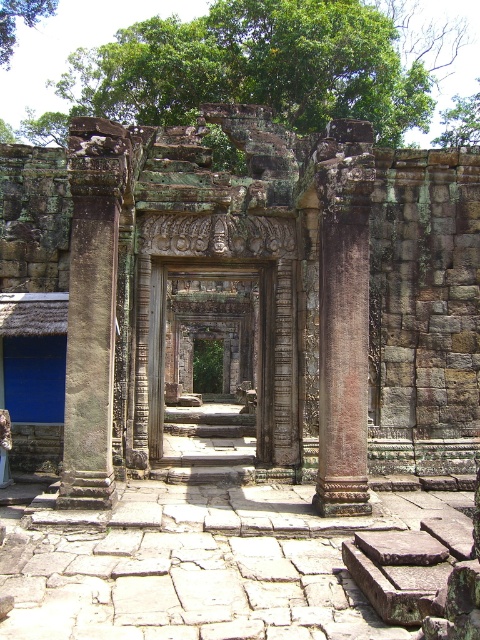
Who is taller, rustic stone column at center or green leafy tree at upper center?

green leafy tree at upper center is taller.

Locate an element on the screen. The height and width of the screenshot is (640, 480). rustic stone column at center is located at coordinates (343, 328).

Does rustic stone column at center have a greater height compared to green leafy tree at upper left?

Yes.

Which is above, rustic stone column at center or green leafy tree at upper left?

green leafy tree at upper left is above.

Who is more forward, (359,160) or (12,44)?

Point (359,160)

You are a GUI agent. You are given a task and a screenshot of the screen. Output one action in this format:
    pyautogui.click(x=<x>, y=<y>)
    Task: Click on the rustic stone column at center
    The width and height of the screenshot is (480, 640).
    Given the screenshot: What is the action you would take?
    pyautogui.click(x=343, y=328)

Is gray stone archway at center taller than weathered stone doorway at center?

Yes.

Which is behind, point (460, 390) or point (164, 451)?

The point (164, 451) is more distant.

Locate an element on the screen. Image resolution: width=480 pixels, height=640 pixels. gray stone archway at center is located at coordinates (245, 296).